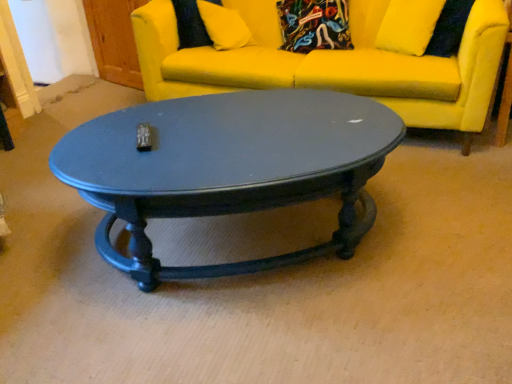
Question: From a real-world perspective, relative to yellow fabric couch at upper center, is yellow fabric pillow at upper center vertically above or below?

Choices:
 (A) below
 (B) above

Answer: (B)

Question: Is yellow fabric pillow at upper center in front of or behind yellow fabric couch at upper center in the image?

Choices:
 (A) behind
 (B) front

Answer: (A)

Question: Which object is the farthest from the yellow fabric pillow at upper center?

Choices:
 (A) yellow fabric couch at upper center
 (B) matte black coffee table at center

Answer: (B)

Question: Estimate the real-world distances between objects in this image. Which object is farther from the yellow fabric couch at upper center?

Choices:
 (A) matte black coffee table at center
 (B) yellow fabric pillow at upper center

Answer: (A)